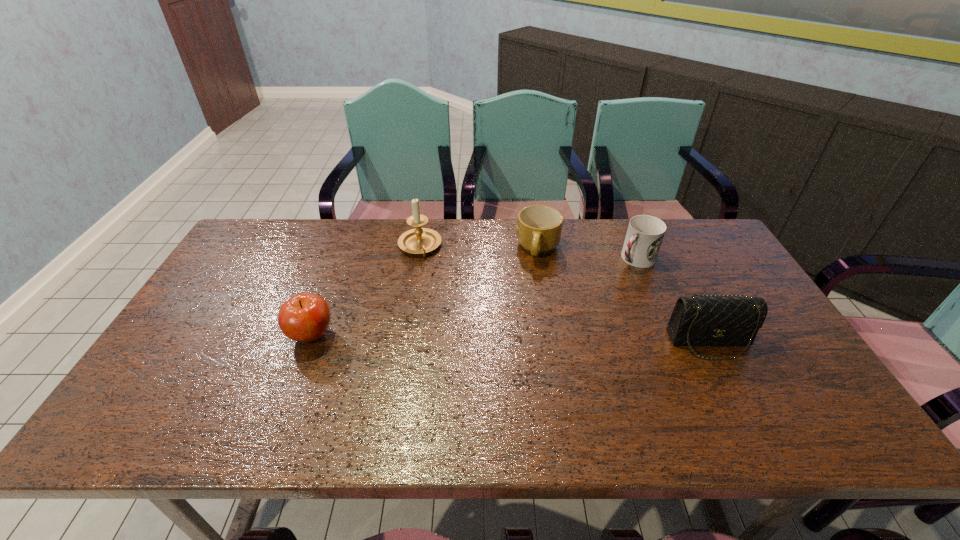
I want to click on vacant space in between the tallest object and the cup, so click(528, 253).

You are a GUI agent. You are given a task and a screenshot of the screen. Output one action in this format:
    pyautogui.click(x=<x>, y=<y>)
    Task: Click on the free spot between the fourth object from right to left and the clutch bag
    
    Given the screenshot: What is the action you would take?
    pyautogui.click(x=564, y=294)

At what (x,y) coordinates should I click in order to perform the action: click on free point between the clutch bag and the mug. Please return your answer as a coordinate pair (x, y). Looking at the image, I should click on (624, 295).

Locate an element on the screen. The height and width of the screenshot is (540, 960). vacant area between the cup and the third object from left to right is located at coordinates (587, 254).

This screenshot has height=540, width=960. Identify the location of free point between the tallest object and the apple. (366, 291).

Image resolution: width=960 pixels, height=540 pixels. I want to click on object that is the second closest to the cup, so click(717, 320).

Where is `object identified as the second closest to the leftmost object`? The image size is (960, 540). object identified as the second closest to the leftmost object is located at coordinates (539, 227).

Find the location of a particular element. vacant area in the image that satisfies the following two spatial constraints: 1. on the front side of the cup; 2. on the left side of the mug is located at coordinates (540, 259).

You are a GUI agent. You are given a task and a screenshot of the screen. Output one action in this format:
    pyautogui.click(x=<x>, y=<y>)
    Task: Click on the vacant position in the image that satisfies the following two spatial constraints: 1. on the front side of the third object from right to left; 2. on the right side of the fourth object from right to left
    The height and width of the screenshot is (540, 960).
    Given the screenshot: What is the action you would take?
    pyautogui.click(x=420, y=249)